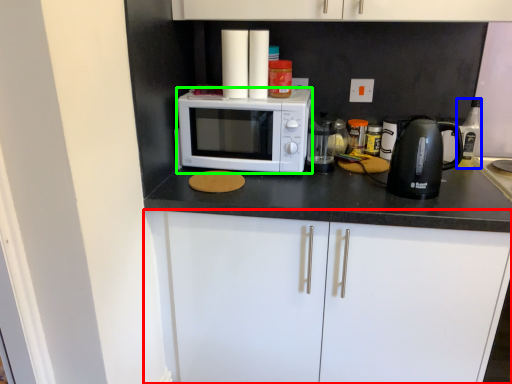
Question: Which is farther away from cabinetry (highlighted by a red box)? bottle (highlighted by a blue box) or microwave oven (highlighted by a green box)?

Choices:
 (A) bottle
 (B) microwave oven

Answer: (A)